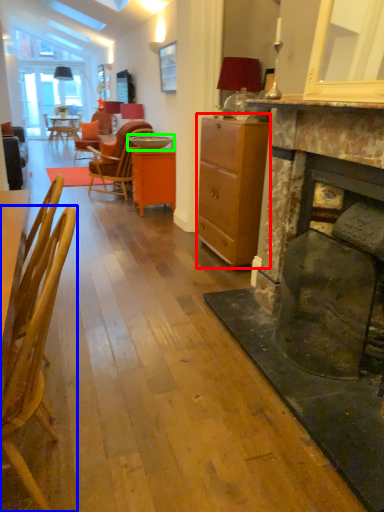
Question: Estimate the real-world distances between objects in this image. Which object is closer to cabinetry (highlighted by a red box), chair (highlighted by a blue box) or round table (highlighted by a green box)?

Choices:
 (A) chair
 (B) round table

Answer: (B)